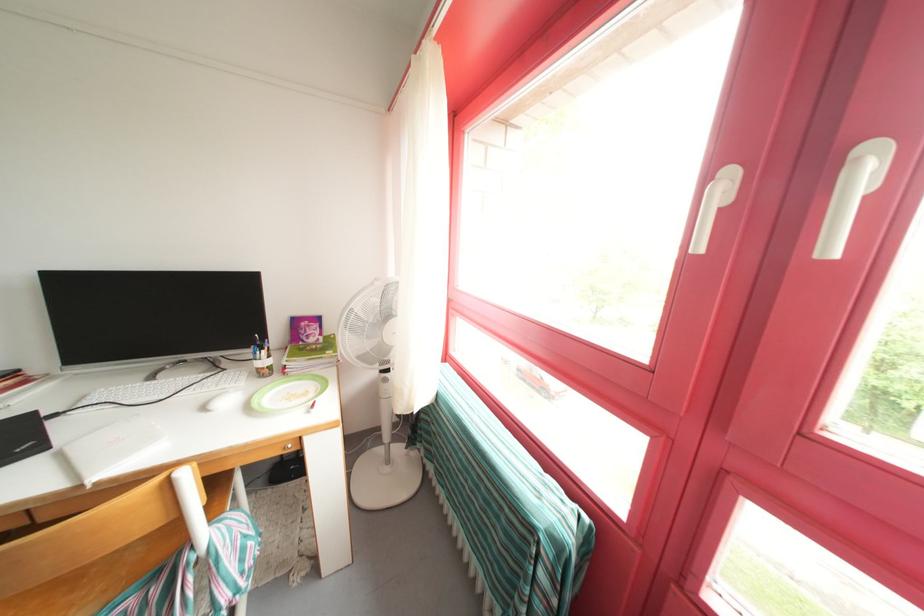
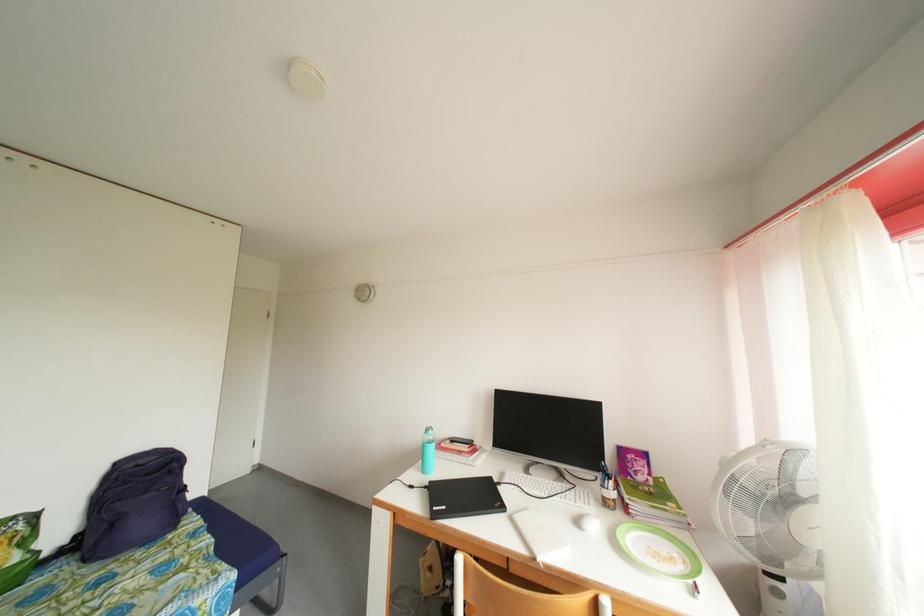
Find the pixel in the second image that matches (211,413) in the first image.

(585, 528)